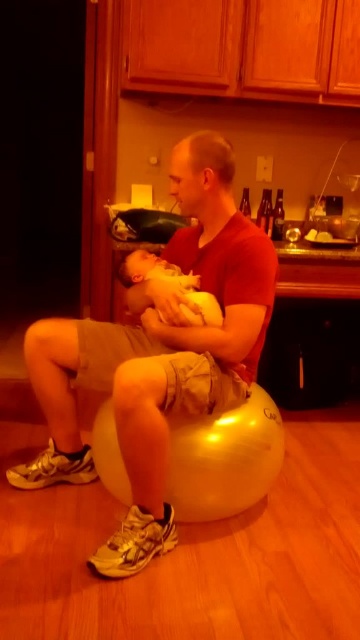
You are a parent trying to place the soft yellow fabric baby at center onto the gold fabric bean bag chair at center. Considering their sizes, will the baby fit comfortably on the chair?

The gold fabric bean bag chair at center is taller than the soft yellow fabric baby at center, so the baby should fit comfortably on the chair since the chair is larger in height.

You are a furniture designer trying to place a new sofa in the kitchen. You have a gold fabric bean bag chair at center and a soft yellow fabric baby at center in the way. Which object takes up more horizontal space?

The gold fabric bean bag chair at center has a larger width than the soft yellow fabric baby at center, so it takes up more horizontal space.

You are standing in the kitchen scene and want to reach an object located at point (x=146, y=467). If your arm can extend 1.6 meters, can you comfortably reach it?

The point is 1.74 meters away from the viewer, which is beyond the arm extension of 1.6 meters, so you cannot comfortably reach it.